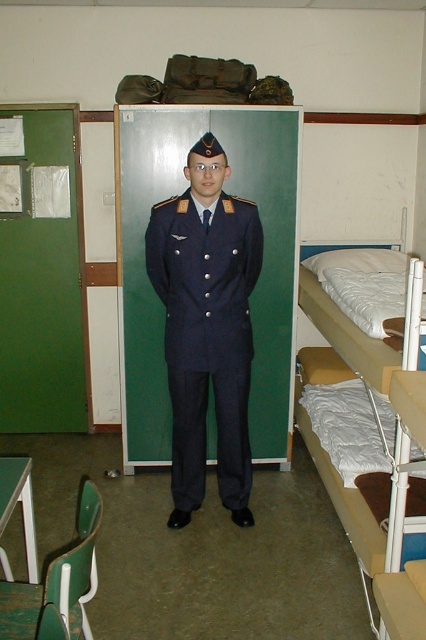
Question: Which point is closer to the camera?

Choices:
 (A) white fabric bunk bed at right
 (B) navy blue uniform at center

Answer: (A)

Question: Can you confirm if navy blue uniform at center is smaller than white fabric bunk bed at right?

Choices:
 (A) yes
 (B) no

Answer: (A)

Question: Where is navy blue uniform at center located in relation to white fabric bunk bed at right in the image?

Choices:
 (A) below
 (B) above

Answer: (B)

Question: Does navy blue uniform at center have a greater width compared to white fabric bunk bed at right?

Choices:
 (A) no
 (B) yes

Answer: (B)

Question: Which point is farther to the camera?

Choices:
 (A) navy blue uniform at center
 (B) white fabric bunk bed at right

Answer: (A)